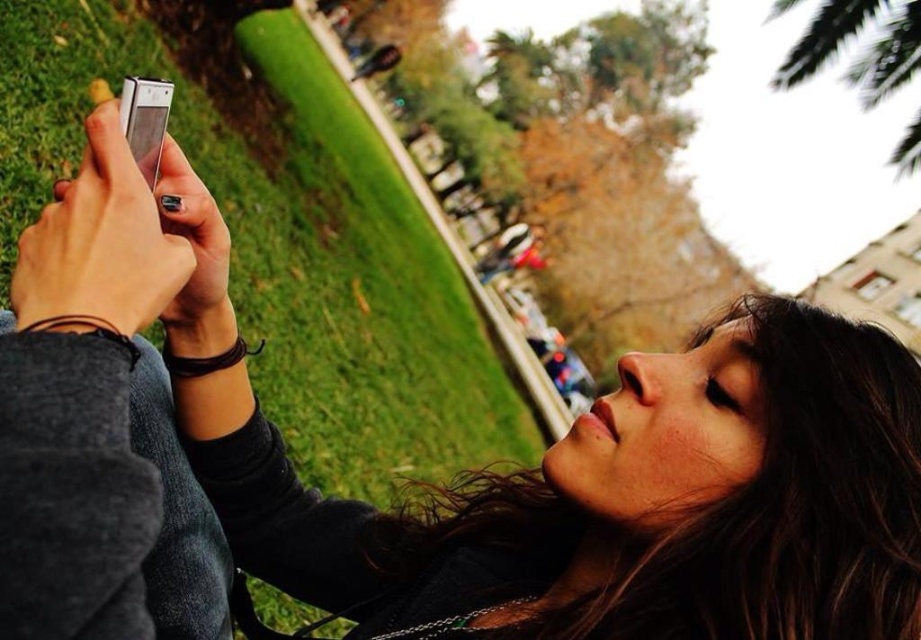
You are a photographer trying to capture the scene in the image. You notice the dark brown hair at upper right and the silver metallic smartphone at upper left. Which object is positioned higher in the frame?

The dark brown hair at upper right is much taller than the silver metallic smartphone at upper left, so it is positioned higher in the frame.

You are a photographer trying to capture a subject in the park. You notice a person holding a smartphone at point (793,504). What is the color of the hair at that point?

The dark brown hair at upper right is located at point (793,504), so the color of the hair at that point is dark brown.